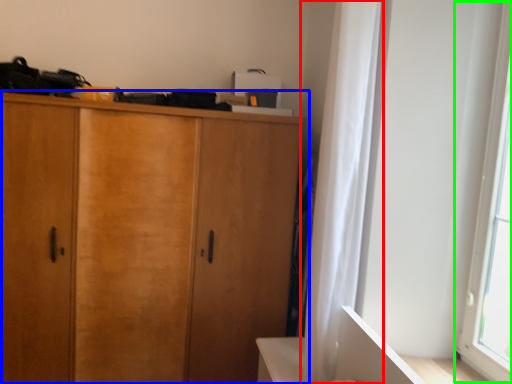
Question: Considering the real-world distances, which object is closest to curtain (highlighted by a red box)? cupboard (highlighted by a blue box) or window screen (highlighted by a green box).

Choices:
 (A) cupboard
 (B) window screen

Answer: (B)